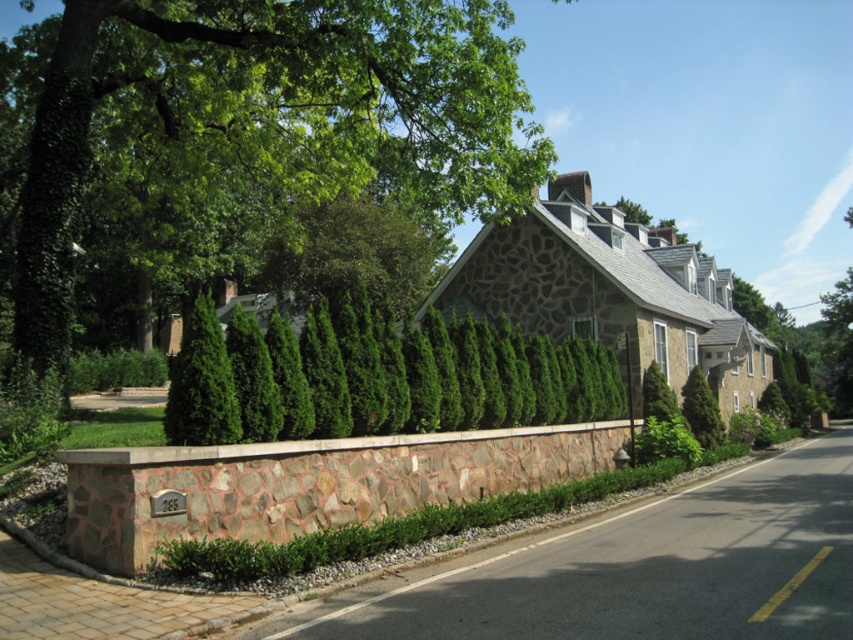
Question: Is green leafy tree at upper left smaller than green coniferous hedge at center?

Choices:
 (A) no
 (B) yes

Answer: (A)

Question: Does green leafy tree at upper left appear over green coniferous hedge at center?

Choices:
 (A) yes
 (B) no

Answer: (A)

Question: Can you confirm if green leafy tree at upper left is positioned below green coniferous hedge at center?

Choices:
 (A) yes
 (B) no

Answer: (B)